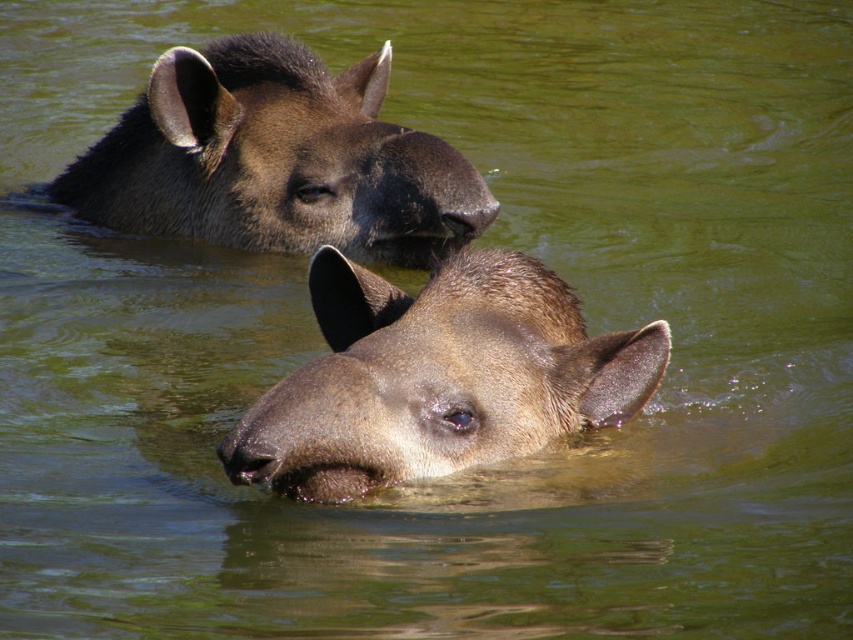
Looking at this image, can you confirm if brown matte tapir head at center is taller than brown matte tapir at upper center?

Incorrect, brown matte tapir head at center's height is not larger of brown matte tapir at upper center's.

Is brown matte tapir head at center thinner than brown matte tapir at upper center?

Correct, brown matte tapir head at center's width is less than brown matte tapir at upper center's.

Does point (454, 452) come closer to viewer compared to point (467, 205)?

Yes, point (454, 452) is closer to viewer.

Locate an element on the screen. Image resolution: width=853 pixels, height=640 pixels. brown matte tapir head at center is located at coordinates (437, 378).